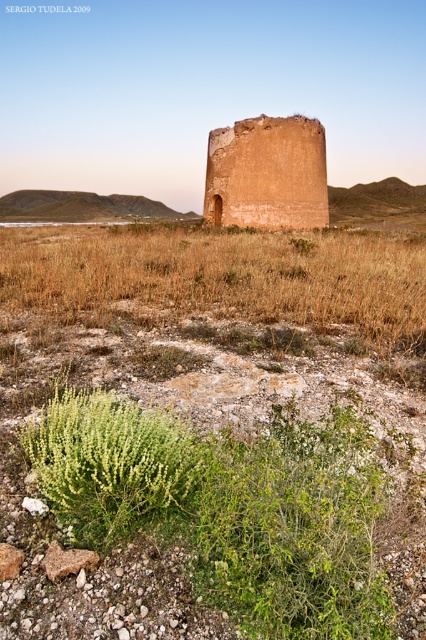
You are standing at point (111, 465) in the image. What do you see around you?

You see a green leafy bush at lower left located at point (111, 465).

You are a hiker carrying a 20 meter rope and you need to secure your gear between the green leafy bush at lower left and the earthy clay tower at center. Is your rope long enough to stretch between them?

The distance between the green leafy bush at lower left and the earthy clay tower at center is 19.54 meters. Since the rope is 20 meters long, it is long enough to stretch between them.

You are a hiker trying to navigate through the rugged terrain. You notice the green leafy bush at lower left and the earthy clay tower at center. Which object is bigger in size?

The green leafy bush at lower left is larger in size compared to the earthy clay tower at center according to the description.